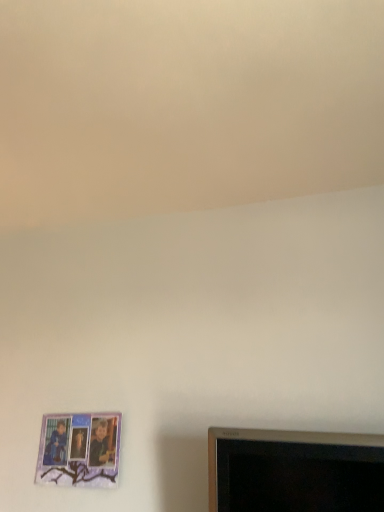
This screenshot has width=384, height=512. What do you see at coordinates (79, 450) in the screenshot?
I see `purple paper picture frame at lower left` at bounding box center [79, 450].

Locate an element on the screen. The image size is (384, 512). purple paper picture frame at lower left is located at coordinates (79, 450).

The width and height of the screenshot is (384, 512). Find the location of `purple paper picture frame at lower left`. purple paper picture frame at lower left is located at coordinates (79, 450).